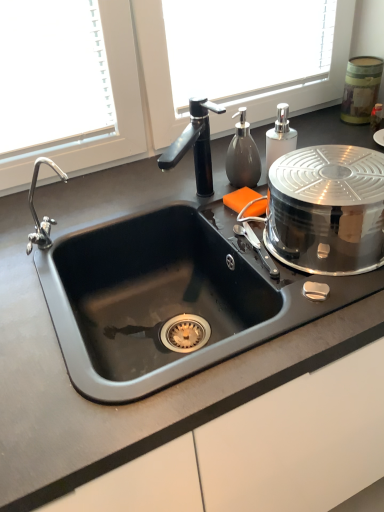
Question: Is polished stainless steel lid at right, which ranks as the 1th appliance in front-to-back order, beside metallic canister at upper right, placed as the 2th appliance when sorted from left to right?

Choices:
 (A) yes
 (B) no

Answer: (B)

Question: From a real-world perspective, is polished stainless steel lid at right, marked as the second appliance in a right-to-left arrangement, located beneath metallic canister at upper right, which is counted as the first appliance, starting from the top?

Choices:
 (A) yes
 (B) no

Answer: (A)

Question: Does polished stainless steel lid at right, the second appliance from the top, have a smaller size compared to metallic canister at upper right, placed as the 2th appliance when sorted from left to right?

Choices:
 (A) no
 (B) yes

Answer: (A)

Question: Can you confirm if polished stainless steel lid at right, which ranks as the 1th appliance in front-to-back order, is thinner than metallic canister at upper right, placed as the 2th appliance when sorted from left to right?

Choices:
 (A) no
 (B) yes

Answer: (A)

Question: Does polished stainless steel lid at right, which ranks as the 1th appliance in front-to-back order, appear on the left side of metallic canister at upper right, placed as the 2th appliance when sorted from left to right?

Choices:
 (A) yes
 (B) no

Answer: (A)

Question: Do you think matte gray soap dispenser at upper right, the second soap dispenser from the right, is within metallic canister at upper right, placed as the 1th appliance when sorted from back to front, or outside of it?

Choices:
 (A) outside
 (B) inside

Answer: (A)

Question: Is matte gray soap dispenser at upper right, the second soap dispenser from the right, wider or thinner than metallic canister at upper right, which is counted as the first appliance, starting from the top?

Choices:
 (A) wide
 (B) thin

Answer: (B)

Question: From the image's perspective, relative to metallic canister at upper right, the first appliance positioned from the right, is matte gray soap dispenser at upper right, the second soap dispenser from the right, above or below?

Choices:
 (A) above
 (B) below

Answer: (B)

Question: From a real-world perspective, is matte gray soap dispenser at upper right, which appears as the first soap dispenser when viewed from the left, above or below metallic canister at upper right, which is the 2th appliance in front-to-back order?

Choices:
 (A) below
 (B) above

Answer: (B)

Question: Considering the relative positions of matte gray soap dispenser at upper right, which appears as the first soap dispenser when viewed from the left, and polished stainless steel lid at right, which is the first appliance in bottom-to-top order, in the image provided, is matte gray soap dispenser at upper right, which appears as the first soap dispenser when viewed from the left, to the left or to the right of polished stainless steel lid at right, which is the first appliance in bottom-to-top order,?

Choices:
 (A) left
 (B) right

Answer: (A)

Question: From a real-world perspective, is matte gray soap dispenser at upper right, which appears as the first soap dispenser when viewed from the left, positioned above or below polished stainless steel lid at right, marked as the second appliance in a right-to-left arrangement?

Choices:
 (A) above
 (B) below

Answer: (A)

Question: From their relative heights in the image, would you say matte gray soap dispenser at upper right, which appears as the first soap dispenser when viewed from the left, is taller or shorter than polished stainless steel lid at right, marked as the 2th appliance in a back-to-front arrangement?

Choices:
 (A) tall
 (B) short

Answer: (B)

Question: Looking at their shapes, would you say matte gray soap dispenser at upper right, the second soap dispenser from the right, is wider or thinner than polished stainless steel lid at right, the second appliance from the top?

Choices:
 (A) thin
 (B) wide

Answer: (A)

Question: Considering the positions of metallic canister at upper right, placed as the 2th appliance when sorted from left to right, and matte gray soap dispenser at upper right, the second soap dispenser from the right, in the image, is metallic canister at upper right, placed as the 2th appliance when sorted from left to right, bigger or smaller than matte gray soap dispenser at upper right, the second soap dispenser from the right,?

Choices:
 (A) big
 (B) small

Answer: (A)

Question: From the image's perspective, is metallic canister at upper right, placed as the 1th appliance when sorted from back to front, located above or below matte gray soap dispenser at upper right, which appears as the first soap dispenser when viewed from the left?

Choices:
 (A) below
 (B) above

Answer: (B)